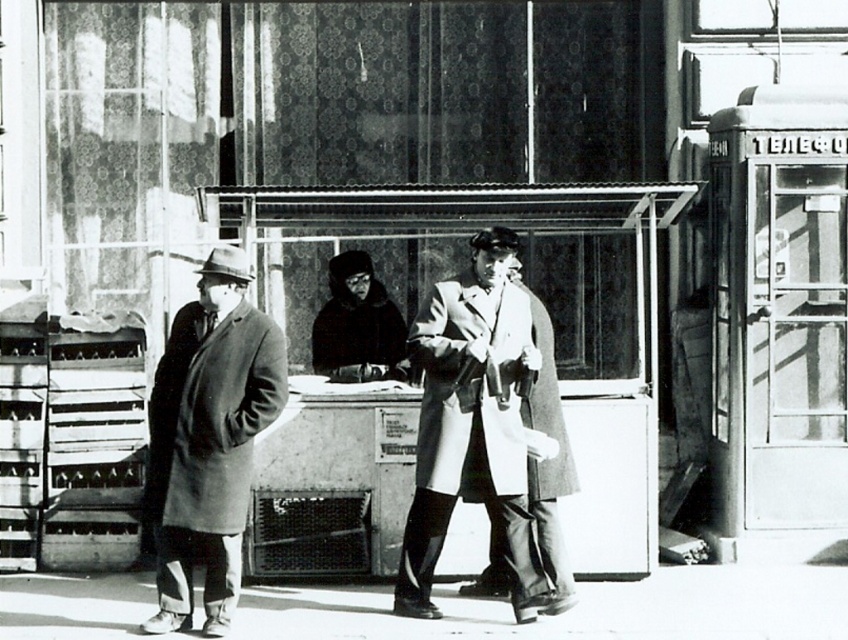
You are a tailor observing two coats in the image. The light gray wool coat at center and the velvet black coat at center. Which coat would you recommend to a customer who wants a more voluminous style?

The light gray wool coat at center is larger in size than the velvet black coat at center, so it would be the better choice for a more voluminous style.

Based on the photo, based on the scene described, which object occupies more space in the image? The metallic gray kiosk at center or the light gray wool coat at center?

The metallic gray kiosk at center is larger in size than the light gray wool coat at center, so it occupies more space in the image.

Based on the scene described, which coat, the matte gray coat at left or the velvet black coat at center, has a greater width?

The matte gray coat at left is wider than the velvet black coat at center according to the description.